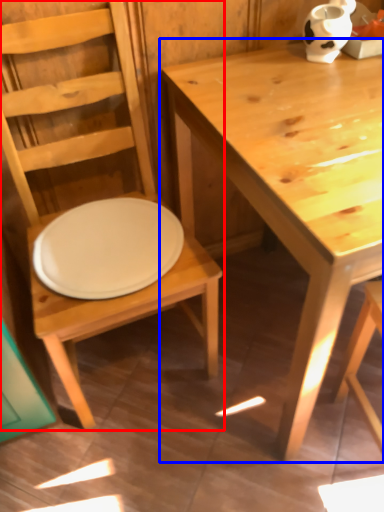
Question: Which object appears closest to the camera in this image, chair (highlighted by a red box) or table (highlighted by a blue box)?

Choices:
 (A) chair
 (B) table

Answer: (A)